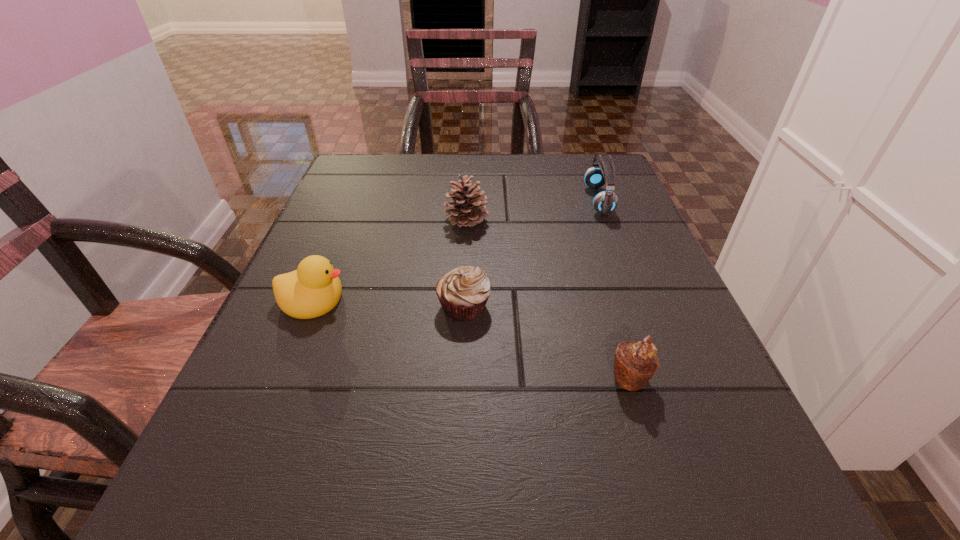
I want to click on free region at the near edge of the desktop, so pyautogui.click(x=495, y=495).

You are a GUI agent. You are given a task and a screenshot of the screen. Output one action in this format:
    pyautogui.click(x=<x>, y=<y>)
    Task: Click on the vacant space at the left edge
    
    Given the screenshot: What is the action you would take?
    pyautogui.click(x=336, y=246)

In the image, there is a desktop. Identify the location of free space at the right edge. (675, 460).

Where is `vacant space at the far left corner of the desktop`? Image resolution: width=960 pixels, height=540 pixels. vacant space at the far left corner of the desktop is located at coordinates (368, 199).

This screenshot has height=540, width=960. In order to click on free space at the far right corner of the desktop in this screenshot , I will do `click(589, 159)`.

What are the coordinates of `vacant space at the near right corner of the desktop` in the screenshot? It's located at (729, 487).

You are a GUI agent. You are given a task and a screenshot of the screen. Output one action in this format:
    pyautogui.click(x=<x>, y=<y>)
    Task: Click on the free spot between the headset and the pinecone
    
    Given the screenshot: What is the action you would take?
    pyautogui.click(x=533, y=210)

Locate an element on the screen. The image size is (960, 540). free space between the headset and the nearer muffin is located at coordinates coord(614,289).

Where is `empty space between the headset and the right muffin`? The height and width of the screenshot is (540, 960). empty space between the headset and the right muffin is located at coordinates (614, 289).

I want to click on free spot between the duckling and the headset, so click(456, 250).